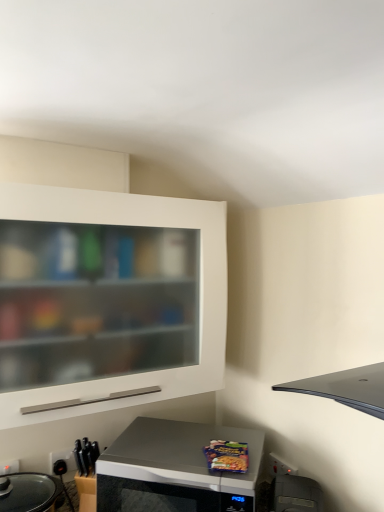
Question: From the image's perspective, is silver metallic microwave at lower center on black plastic electric outlet at lower left?

Choices:
 (A) no
 (B) yes

Answer: (A)

Question: Does silver metallic microwave at lower center have a larger size compared to black plastic electric outlet at lower left?

Choices:
 (A) no
 (B) yes

Answer: (B)

Question: Is the position of silver metallic microwave at lower center more distant than that of black plastic electric outlet at lower left?

Choices:
 (A) yes
 (B) no

Answer: (B)

Question: Can you confirm if silver metallic microwave at lower center is positioned to the left of black plastic electric outlet at lower left?

Choices:
 (A) yes
 (B) no

Answer: (B)

Question: From the image's perspective, does silver metallic microwave at lower center appear lower than black plastic electric outlet at lower left?

Choices:
 (A) yes
 (B) no

Answer: (A)

Question: Is white matte cabinet at upper left wider or thinner than silver metallic microwave at lower center?

Choices:
 (A) thin
 (B) wide

Answer: (A)

Question: From their relative heights in the image, would you say white matte cabinet at upper left is taller or shorter than silver metallic microwave at lower center?

Choices:
 (A) short
 (B) tall

Answer: (B)

Question: From the image's perspective, is white matte cabinet at upper left above or below silver metallic microwave at lower center?

Choices:
 (A) above
 (B) below

Answer: (A)

Question: From a real-world perspective, is white matte cabinet at upper left physically located above or below silver metallic microwave at lower center?

Choices:
 (A) below
 (B) above

Answer: (B)

Question: Is point (66, 465) positioned closer to the camera than point (153, 214)?

Choices:
 (A) farther
 (B) closer

Answer: (A)

Question: From the image's perspective, is black plastic electric outlet at lower left positioned above or below white matte cabinet at upper left?

Choices:
 (A) above
 (B) below

Answer: (B)

Question: Choose the correct answer: Is black plastic electric outlet at lower left inside white matte cabinet at upper left or outside it?

Choices:
 (A) outside
 (B) inside

Answer: (A)

Question: Is black plastic electric outlet at lower left in front of or behind white matte cabinet at upper left in the image?

Choices:
 (A) behind
 (B) front

Answer: (A)

Question: Choose the correct answer: Is silver metallic microwave at lower center inside black plastic toaster at lower right or outside it?

Choices:
 (A) inside
 (B) outside

Answer: (B)

Question: In the image, is silver metallic microwave at lower center positioned in front of or behind black plastic toaster at lower right?

Choices:
 (A) front
 (B) behind

Answer: (B)